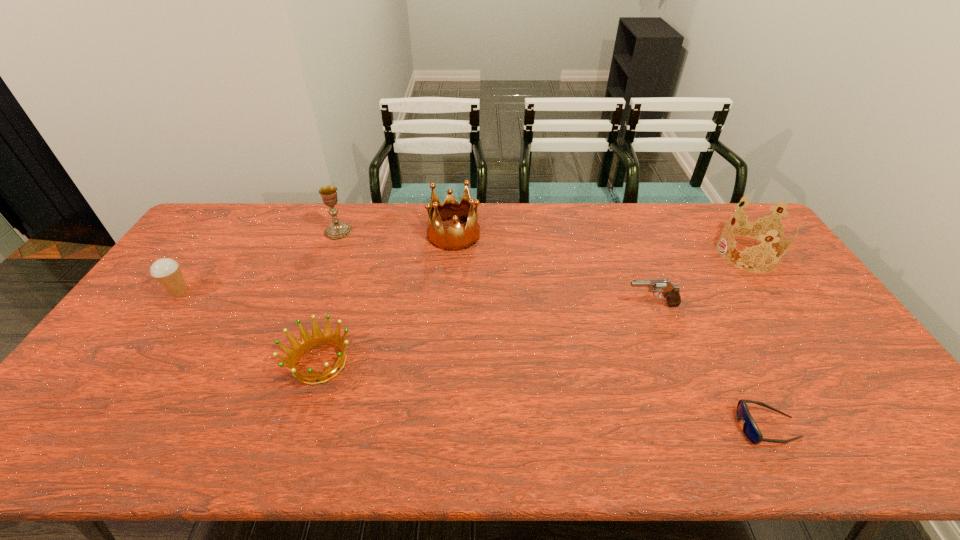
Where is `vacant point located between the second crown from left to right and the chalice`? This screenshot has height=540, width=960. vacant point located between the second crown from left to right and the chalice is located at coordinates (396, 233).

The height and width of the screenshot is (540, 960). I want to click on vacant area between the sixth farthest object and the chalice, so pos(329,297).

You are a GUI agent. You are given a task and a screenshot of the screen. Output one action in this format:
    pyautogui.click(x=<x>, y=<y>)
    Task: Click on the object that is the sixth nearest to the leftmost crown
    
    Given the screenshot: What is the action you would take?
    pyautogui.click(x=760, y=229)

Locate which object ranks third in proximity to the pistol. Please provide its 2D coordinates. Your answer should be formatted as a tuple, i.e. [(x, y)], where the tuple contains the x and y coordinates of a point satisfying the conditions above.

[(455, 238)]

Where is `crown that is the third closest to the sunglasses`? Image resolution: width=960 pixels, height=540 pixels. crown that is the third closest to the sunglasses is located at coordinates (307, 342).

Where is `crown that stands as the closest to the nearest crown`? The height and width of the screenshot is (540, 960). crown that stands as the closest to the nearest crown is located at coordinates (455, 238).

Identify the location of free location that satisfies the following two spatial constraints: 1. on the back side of the second crown from right to left; 2. on the right side of the leftmost object. (220, 234).

Locate an element on the screen. free spot that satisfies the following two spatial constraints: 1. on the back side of the leftmost object; 2. on the left side of the second crown from left to right is located at coordinates (220, 234).

The width and height of the screenshot is (960, 540). Identify the location of free location that satisfies the following two spatial constraints: 1. on the front side of the nearest crown; 2. on the right side of the chalice. (287, 363).